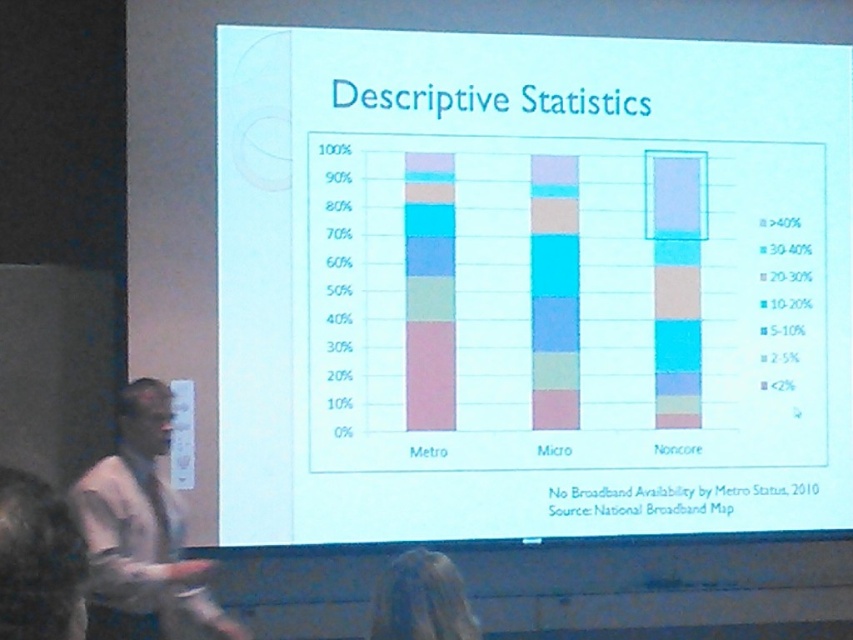
How distant is white paper at center from blonde hair at lower center?

The distance of white paper at center from blonde hair at lower center is 8.45 feet.

In order to click on white paper at center in this screenshot , I will do `click(531, 285)`.

Is point (137, 541) positioned before point (381, 600)?

No, it is behind (381, 600).

Is white shirt at left in front of blonde hair at lower center?

No, white shirt at left is further to the viewer.

Between point (125, 529) and point (440, 573), which one is positioned in front?

Positioned in front is point (440, 573).

Identify the location of white shirt at left. (142, 536).

Describe the element at coordinates (531, 285) in the screenshot. The width and height of the screenshot is (853, 640). I see `white paper at center` at that location.

Looking at this image, who is more forward, (x=312, y=522) or (x=115, y=458)?

Point (x=115, y=458) is more forward.

This screenshot has height=640, width=853. In order to click on white paper at center in this screenshot , I will do `click(531, 285)`.